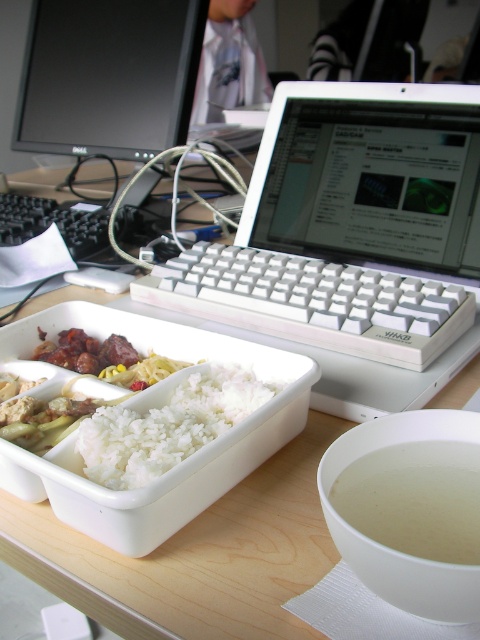
Question: Which of the following is the farthest from the observer?

Choices:
 (A) black glossy monitor at upper left
 (B) white matte rice at center

Answer: (A)

Question: Estimate the real-world distances between objects in this image. Which object is farther from the white plastic laptop at center?

Choices:
 (A) translucent white soup at lower right
 (B) black glossy monitor at upper left

Answer: (B)

Question: Considering the relative positions of white plastic laptop at center and black glossy monitor at upper left in the image provided, where is white plastic laptop at center located with respect to black glossy monitor at upper left?

Choices:
 (A) below
 (B) above

Answer: (A)

Question: Among these points, which one is nearest to the camera?

Choices:
 (A) (59, 88)
 (B) (464, 323)
 (C) (474, 516)
 (D) (277, 388)

Answer: (C)

Question: Can you confirm if black glossy monitor at upper left is smaller than white matte rice at center?

Choices:
 (A) yes
 (B) no

Answer: (B)

Question: Is black glossy monitor at upper left smaller than translucent white soup at lower right?

Choices:
 (A) no
 (B) yes

Answer: (A)